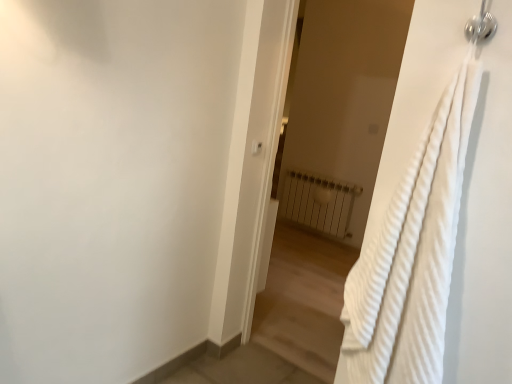
Question: Is white plastic light switch at upper center aimed at white textured towel at right?

Choices:
 (A) yes
 (B) no

Answer: (B)

Question: Is white textured towel at right located within white plastic light switch at upper center?

Choices:
 (A) yes
 (B) no

Answer: (B)

Question: Is white plastic light switch at upper center behind white textured towel at right?

Choices:
 (A) yes
 (B) no

Answer: (A)

Question: Can you confirm if white plastic light switch at upper center is thinner than white textured towel at right?

Choices:
 (A) no
 (B) yes

Answer: (B)

Question: From the image's perspective, does white plastic light switch at upper center appear higher than white textured towel at right?

Choices:
 (A) no
 (B) yes

Answer: (B)

Question: Are white plastic light switch at upper center and white textured towel at right making contact?

Choices:
 (A) yes
 (B) no

Answer: (B)

Question: From a real-world perspective, is white metallic radiator at center located beneath white textured towel at right?

Choices:
 (A) no
 (B) yes

Answer: (B)

Question: From a real-world perspective, is white metallic radiator at center on top of white textured towel at right?

Choices:
 (A) yes
 (B) no

Answer: (B)

Question: Can you confirm if white metallic radiator at center is smaller than white textured towel at right?

Choices:
 (A) no
 (B) yes

Answer: (B)

Question: Is white metallic radiator at center thinner than white textured towel at right?

Choices:
 (A) no
 (B) yes

Answer: (A)

Question: Are white metallic radiator at center and white textured towel at right far apart?

Choices:
 (A) yes
 (B) no

Answer: (B)

Question: Is white metallic radiator at center aimed at white textured towel at right?

Choices:
 (A) yes
 (B) no

Answer: (A)

Question: Considering the relative sizes of white textured towel at right and white textured towel at right in the image provided, is white textured towel at right thinner than white textured towel at right?

Choices:
 (A) yes
 (B) no

Answer: (B)